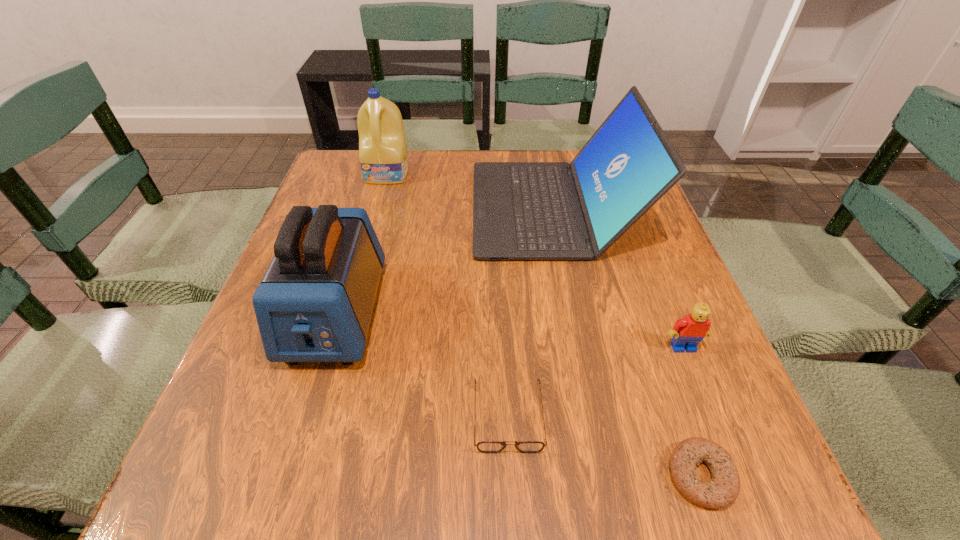
Identify the location of vacant area between the sunglasses and the toaster. The image size is (960, 540). (422, 364).

Where is `vacant space that's between the second shortest object and the laptop computer`? This screenshot has height=540, width=960. vacant space that's between the second shortest object and the laptop computer is located at coordinates (531, 312).

Image resolution: width=960 pixels, height=540 pixels. Find the location of `free area in between the toaster and the shortest object`. free area in between the toaster and the shortest object is located at coordinates (518, 394).

In order to click on vacant space that is in between the laptop computer and the Lego in this screenshot , I will do `click(618, 278)`.

Locate an element on the screen. The height and width of the screenshot is (540, 960). empty location between the fifth tallest object and the laptop computer is located at coordinates (531, 312).

Where is `free space between the toaster and the laptop computer`? The height and width of the screenshot is (540, 960). free space between the toaster and the laptop computer is located at coordinates (444, 261).

Where is `empty space between the detergent and the bagel`? This screenshot has width=960, height=540. empty space between the detergent and the bagel is located at coordinates (544, 325).

Find the location of `free area in between the laptop computer and the shortest object`. free area in between the laptop computer and the shortest object is located at coordinates (627, 342).

Find the location of `unoccupied position between the detergent and the shortest object`. unoccupied position between the detergent and the shortest object is located at coordinates (544, 325).

Locate which object is the fifth closest to the fourth tallest object. Please provide its 2D coordinates. Your answer should be formatted as a tuple, i.e. [(x, y)], where the tuple contains the x and y coordinates of a point satisfying the conditions above.

[(383, 157)]